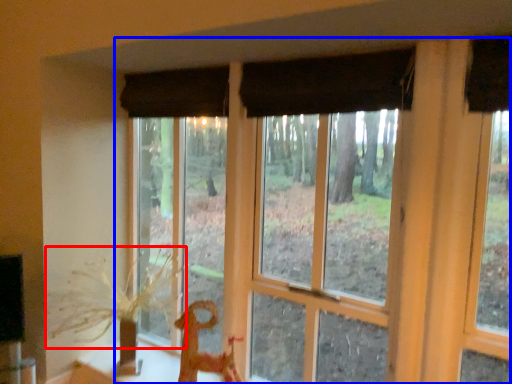
Question: Which object appears closest to the camera in this image, plant (highlighted by a red box) or window (highlighted by a blue box)?

Choices:
 (A) plant
 (B) window

Answer: (B)